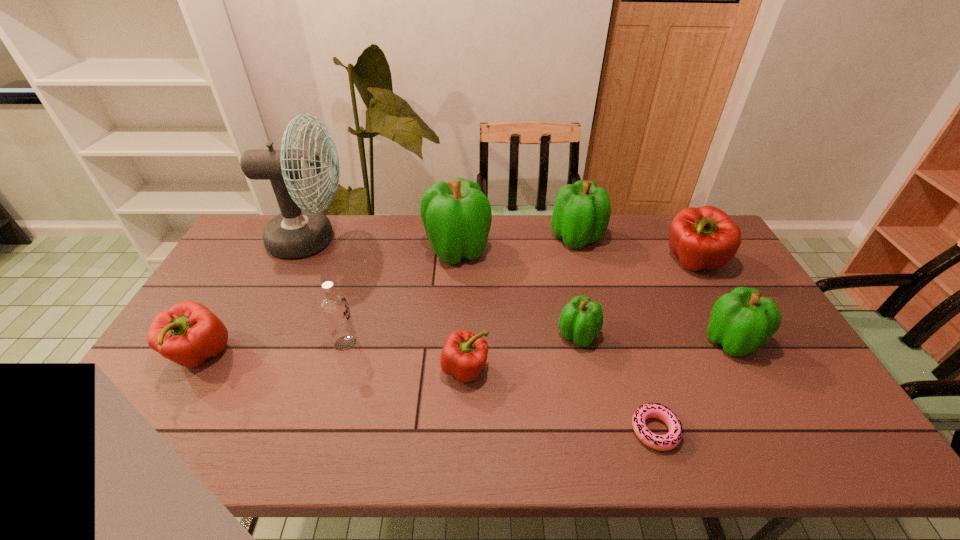
The width and height of the screenshot is (960, 540). In order to click on vacant area situated on the back of the leftmost bell pepper in this screenshot , I will do `click(259, 255)`.

The width and height of the screenshot is (960, 540). Identify the location of free spot located 0.240m on the back of the smallest green bell pepper. (564, 267).

Image resolution: width=960 pixels, height=540 pixels. In order to click on free location located on the left of the smallest pink bell pepper in this screenshot , I will do `click(377, 369)`.

I want to click on vacant space located on the right of the pink doughnut, so click(785, 430).

Where is `fan at the far edge`? The image size is (960, 540). fan at the far edge is located at coordinates (299, 231).

Identify the location of object located in the near edge section of the desktop. The width and height of the screenshot is (960, 540). (669, 441).

Locate an element on the screen. fan positioned at the left edge is located at coordinates [x=299, y=231].

Locate an element on the screen. The image size is (960, 540). bell pepper that is at the left edge is located at coordinates (188, 333).

Find the location of a particular element. The image size is (960, 540). object at the far left corner is located at coordinates (299, 231).

The height and width of the screenshot is (540, 960). Find the location of `object located at the far right corner`. object located at the far right corner is located at coordinates (705, 237).